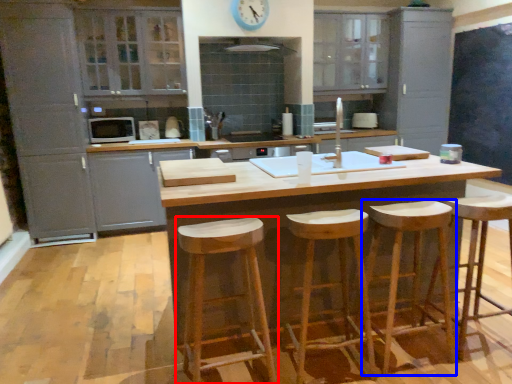
Question: Which object appears farthest to the camera in this image, stool (highlighted by a red box) or stool (highlighted by a blue box)?

Choices:
 (A) stool
 (B) stool

Answer: (B)